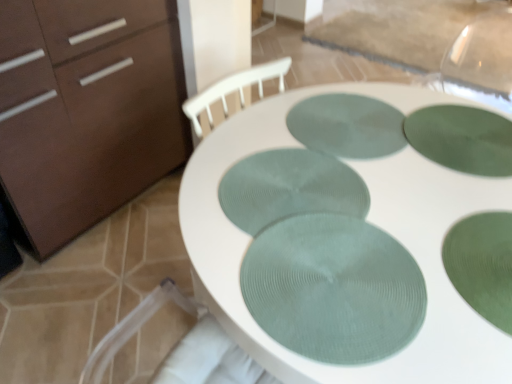
This screenshot has height=384, width=512. What are the coordinates of `free region under green textured glass plate at center, the 3th glass plate viewed from the back (from a real-world perspective)` in the screenshot? It's located at (288, 209).